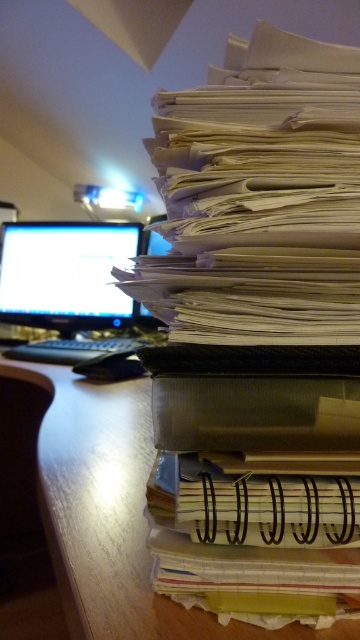
How distant is wooden at right from matte black monitor at left?

The distance of wooden at right from matte black monitor at left is 25.39 inches.

Is wooden at right taller than matte black monitor at left?

No.

What do you see at coordinates (114, 518) in the screenshot?
I see `wooden at right` at bounding box center [114, 518].

Where is `wooden at right`? This screenshot has height=640, width=360. wooden at right is located at coordinates (114, 518).